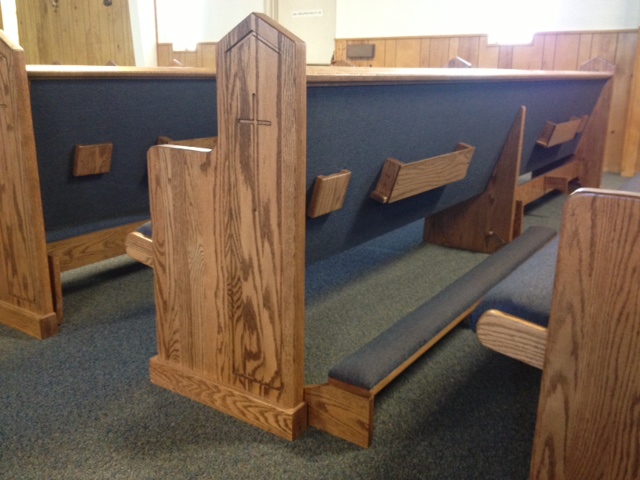
Locate an element on the screen. This screenshot has width=640, height=480. green speckled rug is located at coordinates [63, 433].